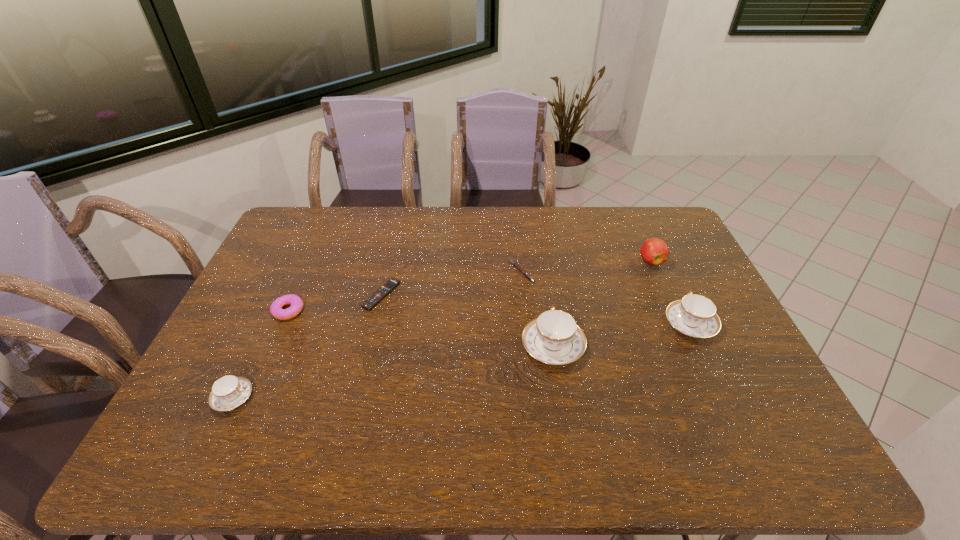
The image size is (960, 540). Find the location of `vacant area that lies between the leftmost teacup and the rightmost teacup`. vacant area that lies between the leftmost teacup and the rightmost teacup is located at coordinates (462, 361).

The width and height of the screenshot is (960, 540). Identify the location of blank region between the second teacup from right to left and the apple. pos(602,304).

Select which object appears as the sixth closest to the second teacup from left to right. Please provide its 2D coordinates. Your answer should be formatted as a tuple, i.e. [(x, y)], where the tuple contains the x and y coordinates of a point satisfying the conditions above.

[(228, 392)]

Choose which object is the second nearest neighbor to the second teacup from left to right. Please provide its 2D coordinates. Your answer should be formatted as a tuple, i.e. [(x, y)], where the tuple contains the x and y coordinates of a point satisfying the conditions above.

[(695, 315)]

Identify which teacup is located as the third nearest to the pen. Please provide its 2D coordinates. Your answer should be formatted as a tuple, i.e. [(x, y)], where the tuple contains the x and y coordinates of a point satisfying the conditions above.

[(228, 392)]

Identify the location of teacup object that ranks as the second closest to the second shortest teacup. This screenshot has height=540, width=960. pos(228,392).

Image resolution: width=960 pixels, height=540 pixels. Find the location of `free space that satisfies the following two spatial constraints: 1. on the side with the handle of the second teacup from left to right; 2. on the right side of the apple`. free space that satisfies the following two spatial constraints: 1. on the side with the handle of the second teacup from left to right; 2. on the right side of the apple is located at coordinates (540, 261).

At what (x,y) coordinates should I click in order to perform the action: click on vacant space that satisfies the following two spatial constraints: 1. on the side with the handle of the second shortest teacup; 2. at the nib of the pen. Please return your answer as a coordinate pair (x, y). The height and width of the screenshot is (540, 960). Looking at the image, I should click on (665, 271).

Where is `free space that satisfies the following two spatial constraints: 1. on the side with the handle of the second teacup from right to left; 2. on the right side of the apple`? The width and height of the screenshot is (960, 540). free space that satisfies the following two spatial constraints: 1. on the side with the handle of the second teacup from right to left; 2. on the right side of the apple is located at coordinates (540, 261).

I want to click on free space that satisfies the following two spatial constraints: 1. on the side with the handle of the apple; 2. on the left side of the second teacup from right to left, so click(540, 261).